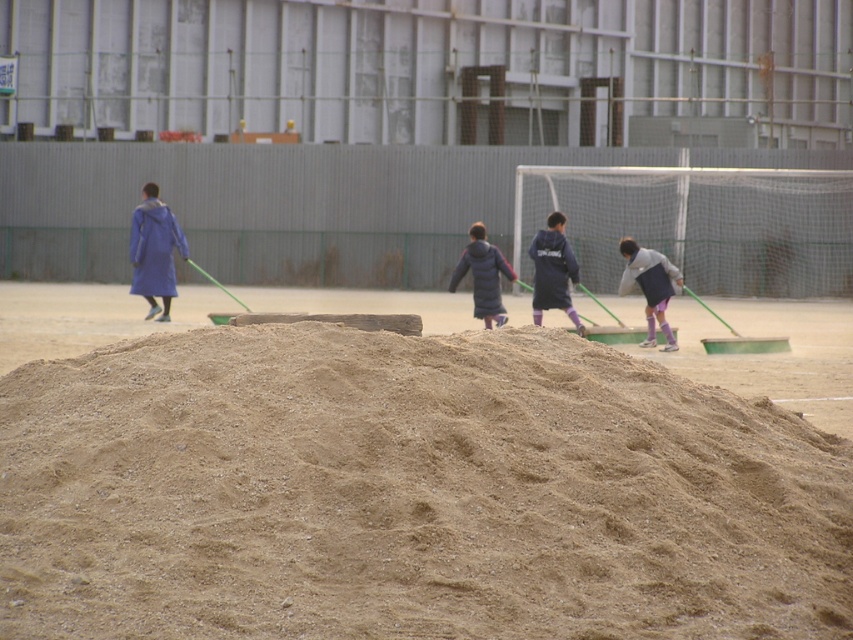
Question: Which is nearer to the matte blue coat at left?

Choices:
 (A) brown sandy mound at center
 (B) light gray fabric jacket at right

Answer: (B)

Question: Where is light gray fabric jacket at right located in relation to dark blue puffy jacket at center in the image?

Choices:
 (A) below
 (B) above

Answer: (A)

Question: Observing the image, what is the correct spatial positioning of matte blue coat at left in reference to light gray fabric jacket at right?

Choices:
 (A) left
 (B) right

Answer: (A)

Question: Where is light gray fabric jacket at right located in relation to dark blue fleece jacket at center in the image?

Choices:
 (A) left
 (B) right

Answer: (B)

Question: Which object is the farthest from the matte blue coat at left?

Choices:
 (A) dark blue fleece jacket at center
 (B) brown sandy mound at center

Answer: (B)

Question: Which point appears farthest from the camera in this image?

Choices:
 (A) (136, 252)
 (B) (560, 300)

Answer: (A)